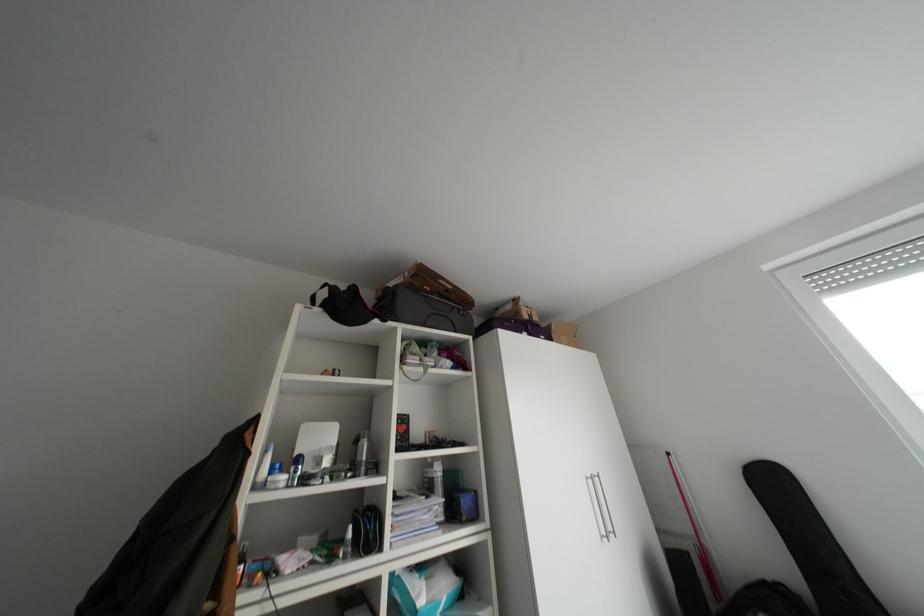
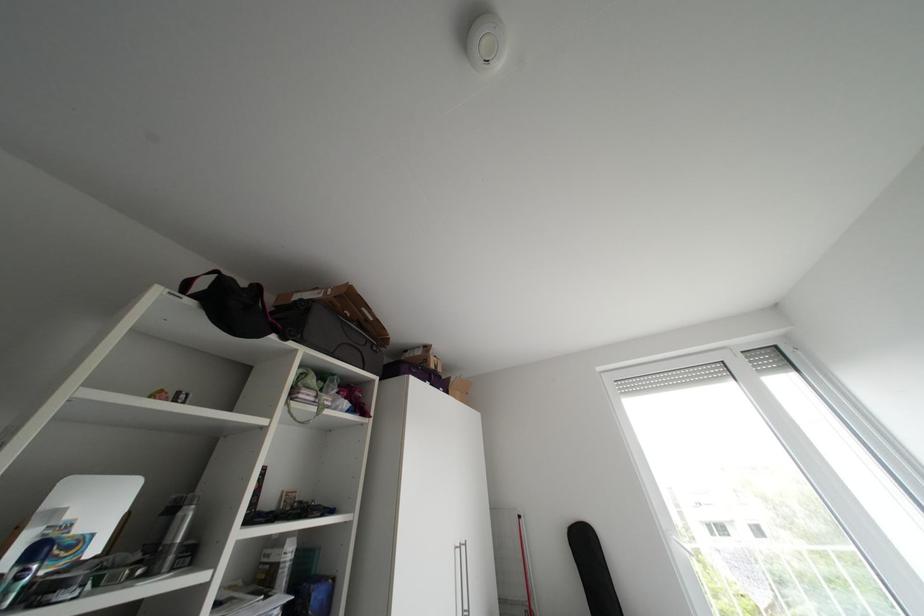
Question: The first image is from the beginning of the video and the second image is from the end. How did the camera likely rotate when shooting the video?

Choices:
 (A) Left
 (B) Right
 (C) Up
 (D) Down

Answer: (B)